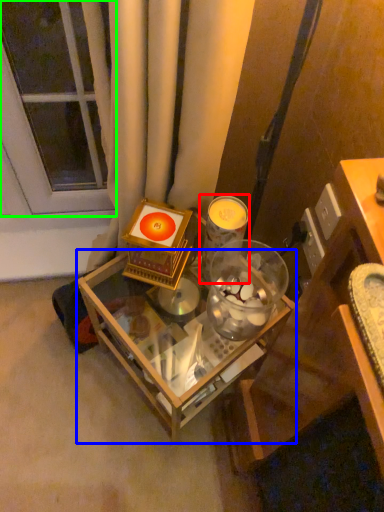
Question: Based on their relative distances, which object is nearer to candle holder (highlighted by a red box)? Choose from table (highlighted by a blue box) and glass door (highlighted by a green box).

Choices:
 (A) table
 (B) glass door

Answer: (A)